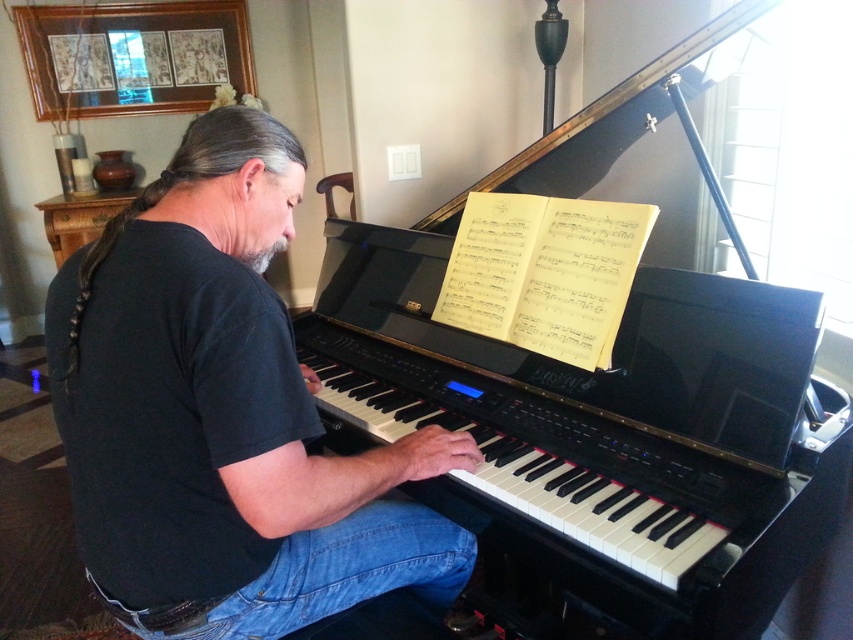
Question: Which point is farther to the camera?

Choices:
 (A) black glossy harpsichord at center
 (B) black cotton shirt at center

Answer: (A)

Question: Is black glossy harpsichord at center positioned behind black cotton shirt at center?

Choices:
 (A) yes
 (B) no

Answer: (A)

Question: Which point appears farthest from the camera in this image?

Choices:
 (A) (572, 531)
 (B) (381, 476)

Answer: (A)

Question: Does black glossy harpsichord at center have a greater width compared to black cotton shirt at center?

Choices:
 (A) yes
 (B) no

Answer: (A)

Question: Does black glossy harpsichord at center have a greater width compared to black cotton shirt at center?

Choices:
 (A) yes
 (B) no

Answer: (A)